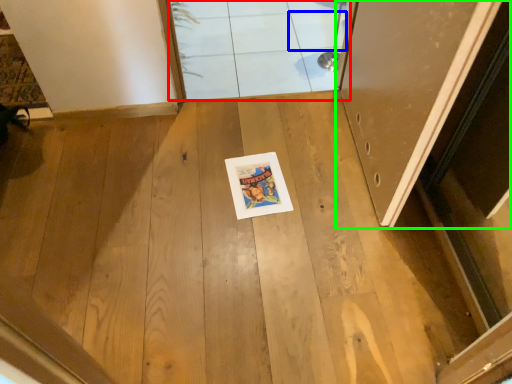
Question: Which is farther away from window (highlighted by a red box)? tile (highlighted by a blue box) or door (highlighted by a green box)?

Choices:
 (A) tile
 (B) door

Answer: (B)